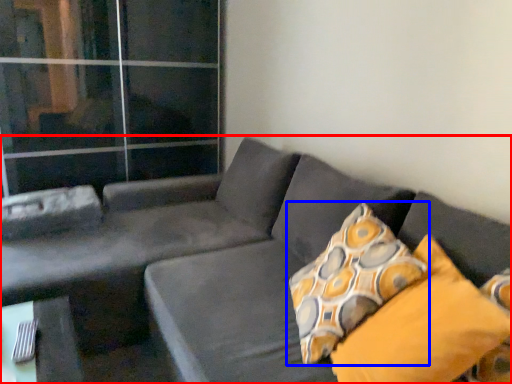
Question: Which point is further to the camera, studio couch (highlighted by a red box) or pillow (highlighted by a blue box)?

Choices:
 (A) studio couch
 (B) pillow

Answer: (B)